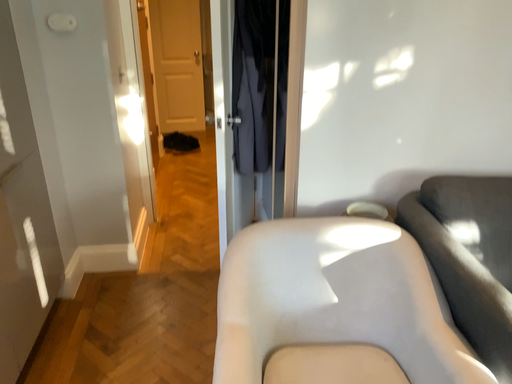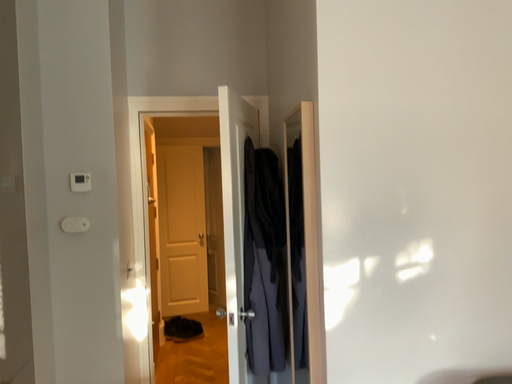
Question: Which way did the camera rotate in the video?

Choices:
 (A) rotated downward
 (B) rotated upward

Answer: (B)